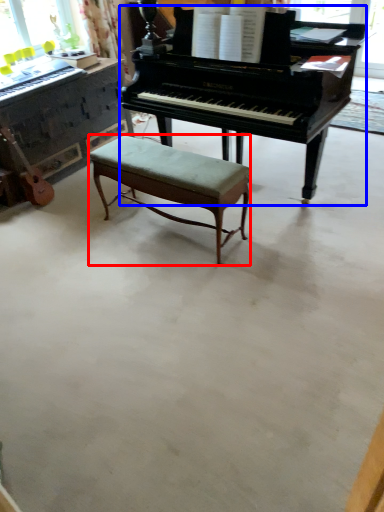
Question: Among these objects, which one is nearest to the camera, stool (highlighted by a red box) or piano (highlighted by a blue box)?

Choices:
 (A) stool
 (B) piano

Answer: (B)